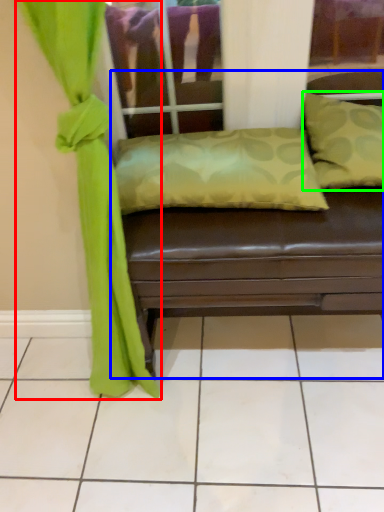
Question: Which is nearer to the curtain (highlighted by a red box)? studio couch (highlighted by a blue box) or pillow (highlighted by a green box).

Choices:
 (A) studio couch
 (B) pillow

Answer: (A)